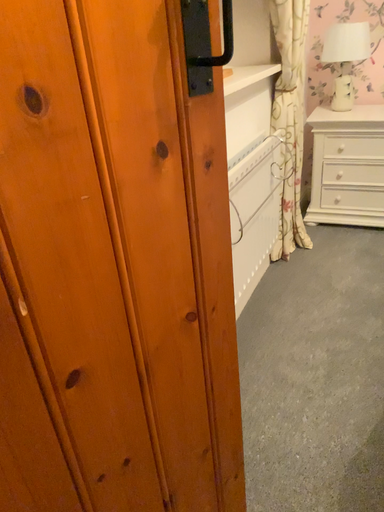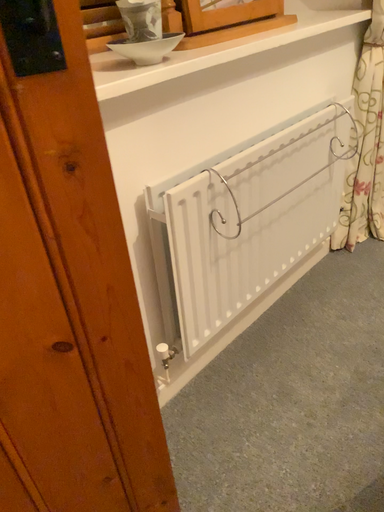
Question: How did the camera likely rotate when shooting the video?

Choices:
 (A) rotated left
 (B) rotated right

Answer: (A)